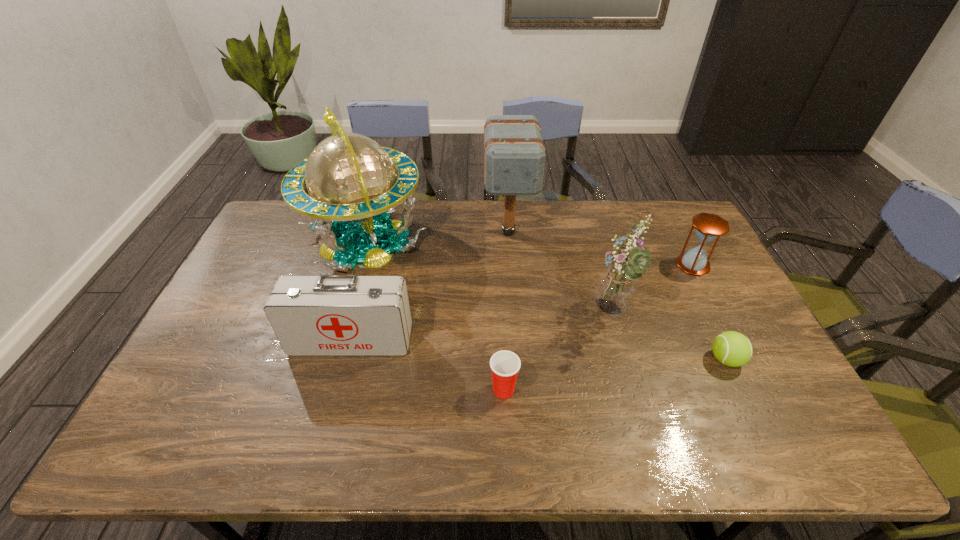
Locate an element on the screen. This screenshot has height=540, width=960. hourglass present at the right edge is located at coordinates pos(708,226).

At what (x,y) coordinates should I click in order to perform the action: click on tennis ball located at the right edge. Please return your answer as a coordinate pair (x, y). Looking at the image, I should click on (733, 349).

Identify the location of object at the far left corner. (348, 185).

The image size is (960, 540). Find the location of `vacant space at the far edge of the desktop`. vacant space at the far edge of the desktop is located at coordinates (431, 228).

Where is `vacant space at the left edge of the desktop`? vacant space at the left edge of the desktop is located at coordinates (194, 397).

In order to click on free space at the right edge in this screenshot , I will do `click(711, 344)`.

The image size is (960, 540). Identify the location of vacant space at the far right corner of the desktop. point(674,228).

I want to click on free space at the near right corner, so click(x=794, y=443).

Find the location of a particular element. empty space between the third object from right to left and the shortest object is located at coordinates (668, 337).

Find the location of a particular element. The width and height of the screenshot is (960, 540). free space between the Dixie cup and the mallet is located at coordinates (506, 310).